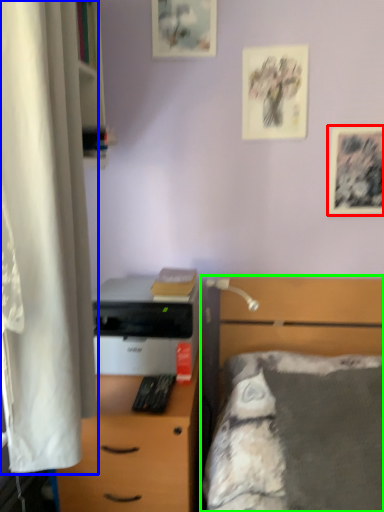
Question: Based on their relative distances, which object is farther from picture frame (highlighted by a red box)? Choose from curtain (highlighted by a blue box) and bed (highlighted by a green box).

Choices:
 (A) curtain
 (B) bed

Answer: (A)